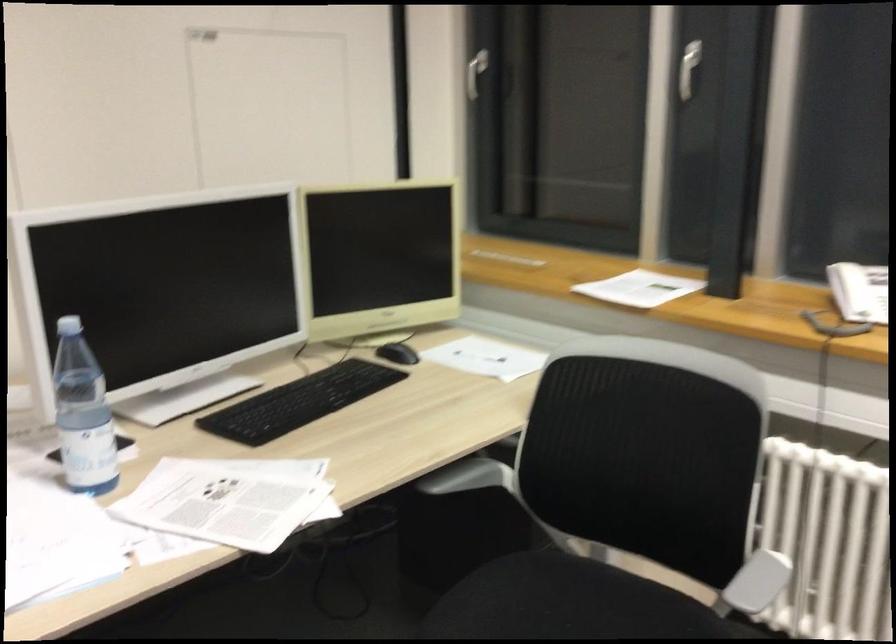
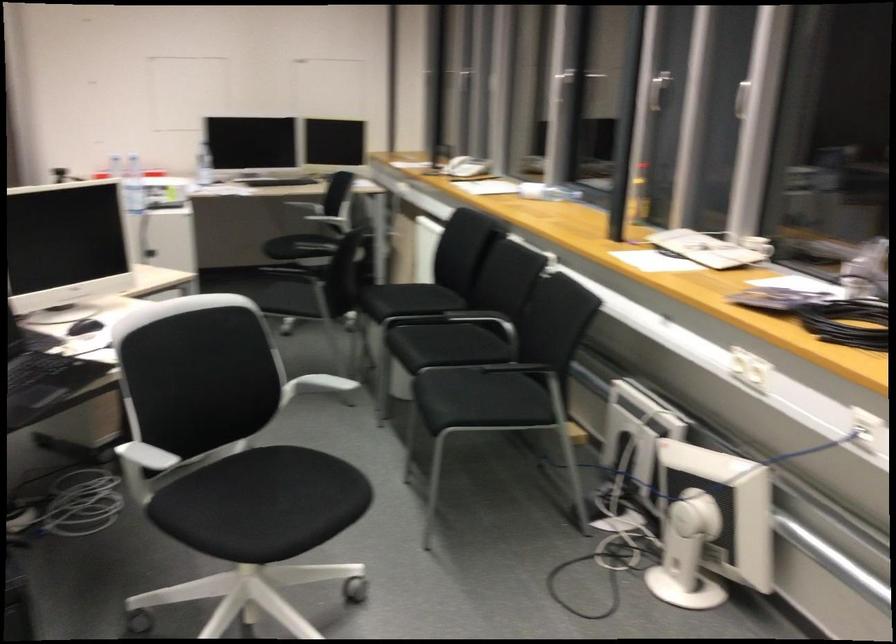
Locate, in the second image, the point that corresponds to point 850,290 in the first image.

(454, 154)